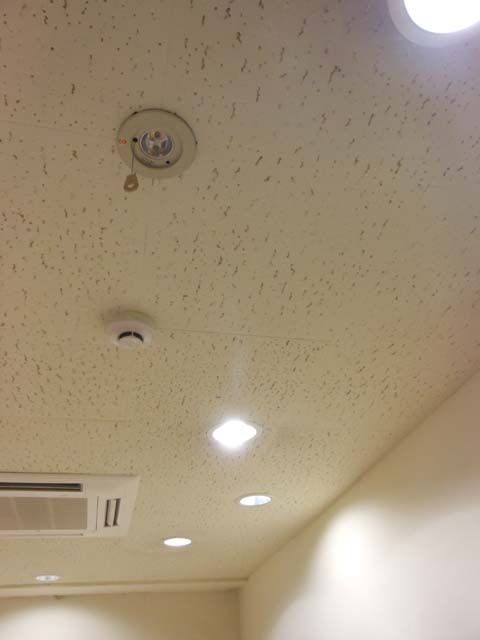
The image size is (480, 640). I want to click on white walls, so click(x=298, y=589), click(x=193, y=589).